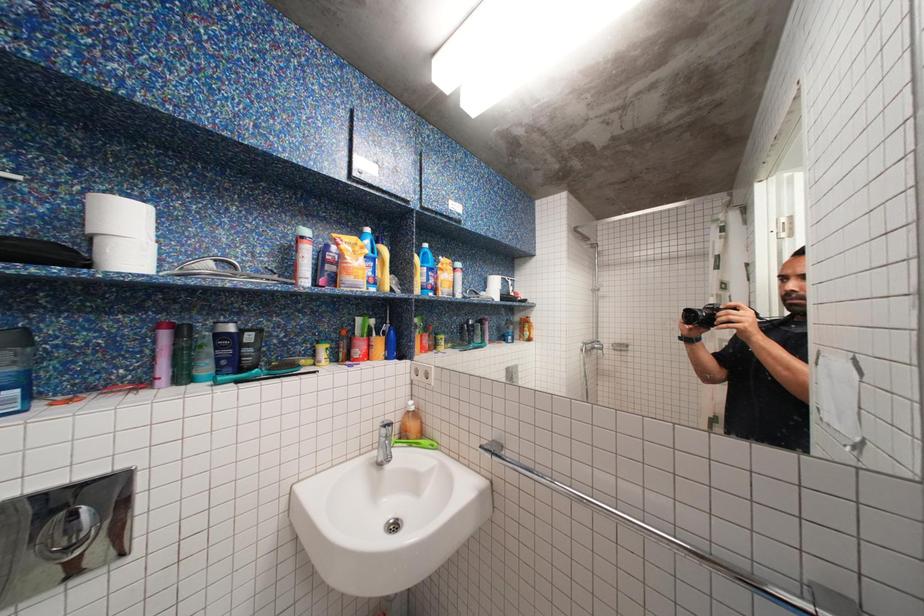
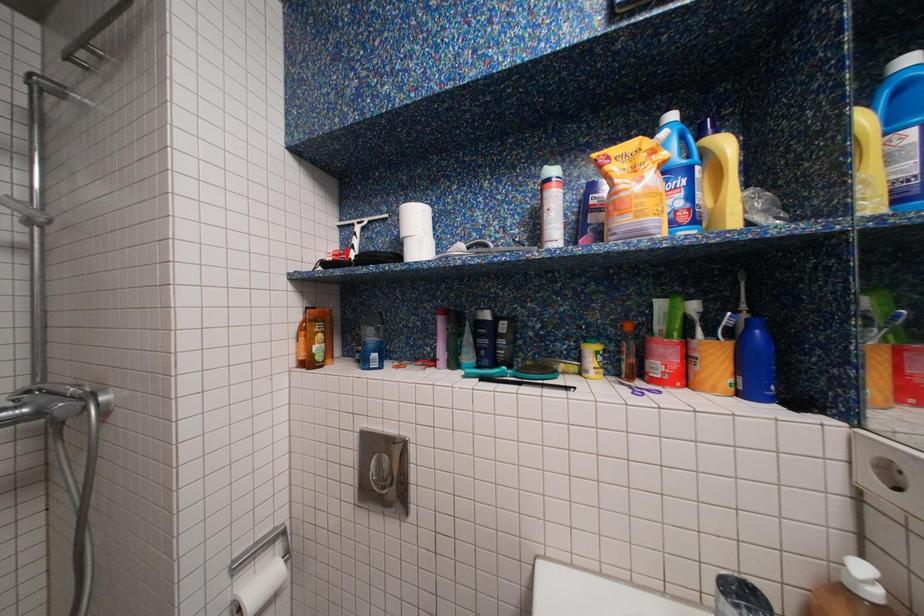
Question: The camera is either moving clockwise (left) or counter-clockwise (right) around the object. The first image is from the beginning of the video and the second image is from the end. Is the camera moving left or right when shooting the video?

Choices:
 (A) Left
 (B) Right

Answer: (B)